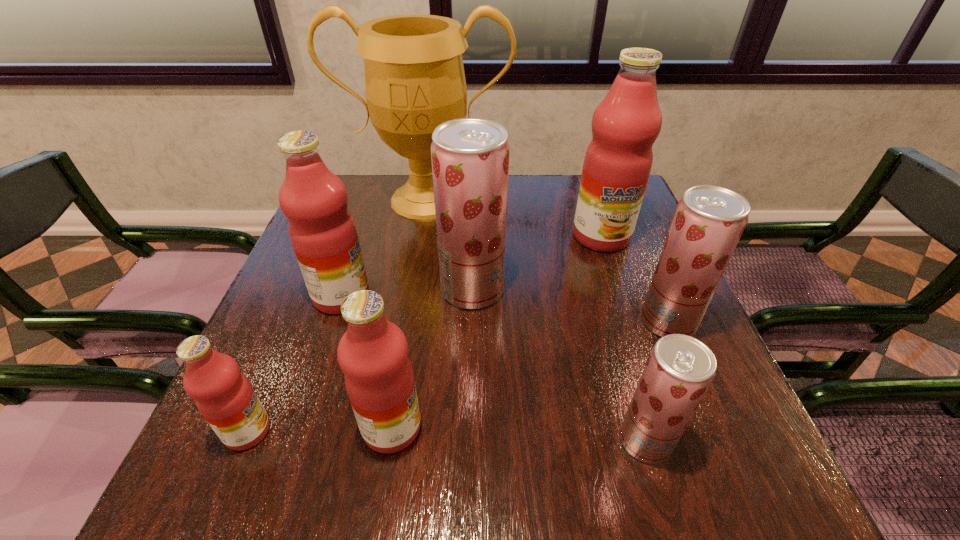
Where is `the smallest strawberry fruit juice`? The width and height of the screenshot is (960, 540). the smallest strawberry fruit juice is located at coordinates (679, 370).

At what (x,y) coordinates should I click in order to perform the action: click on the second strawberry fruit juice from right to left. Please return your answer as a coordinate pair (x, y). Image resolution: width=960 pixels, height=540 pixels. Looking at the image, I should click on 679,370.

I want to click on vacant space situated 0.210m on the engravings side of the trophy, so click(413, 278).

The width and height of the screenshot is (960, 540). Identify the location of vacant space situated on the label of the biggest pink fruit juice. (629, 316).

Identify the location of vacant area situated on the back of the leftmost strawberry fruit juice. (474, 187).

Locate an element on the screen. Image resolution: width=960 pixels, height=540 pixels. vacant region located on the label of the second farthest pink fruit juice is located at coordinates (526, 296).

The image size is (960, 540). In order to click on blank space located 0.270m on the back of the second smallest strawberry fruit juice in this screenshot , I will do `click(629, 231)`.

Find the location of `vacant space situated 0.140m on the label of the second pink fruit juice from right to left`. vacant space situated 0.140m on the label of the second pink fruit juice from right to left is located at coordinates (504, 428).

You are a GUI agent. You are given a task and a screenshot of the screen. Output one action in this format:
    pyautogui.click(x=<x>, y=<y>)
    Task: Click on the vacant space located on the label of the smallest pink fruit juice
    The height and width of the screenshot is (540, 960).
    Given the screenshot: What is the action you would take?
    pyautogui.click(x=382, y=431)

This screenshot has height=540, width=960. In order to click on free space located 0.370m on the back of the second strawberry fruit juice from left to right in this screenshot , I will do `click(597, 276)`.